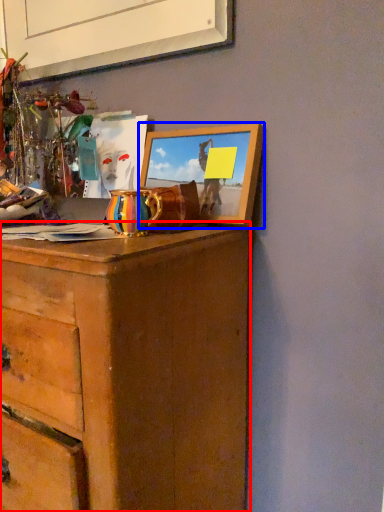
Question: Which point is closer to the camera, chest of drawers (highlighted by a red box) or picture frame (highlighted by a blue box)?

Choices:
 (A) chest of drawers
 (B) picture frame

Answer: (A)